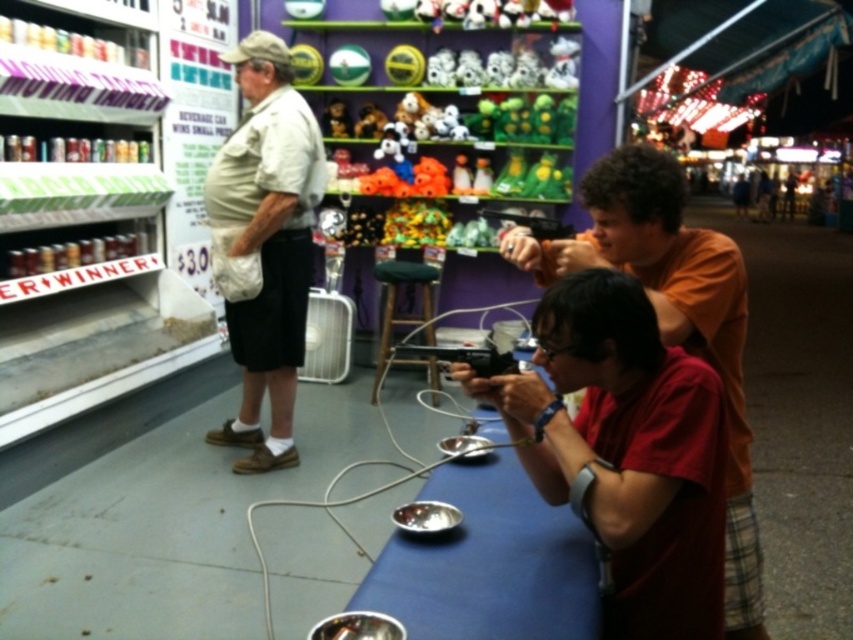
Based on the scene description, where is the orange cotton shirt at center located in terms of its 2D coordinates?

The orange cotton shirt at center is located at the 2D coordinates point (672, 317).

You are a photographer at the fairground. You need to capture a photo of the khaki cotton shirt at left and orange cotton shirt at center without any overlap. Given their widths, which shirt should you position closer to the camera to ensure they don

The khaki cotton shirt at left is wider than the orange cotton shirt at center. To prevent overlap in the photo, position the khaki cotton shirt at left closer to the camera so its larger width occupies more space in the frame, allowing the orange cotton shirt at center to fit beside it without overlapping.